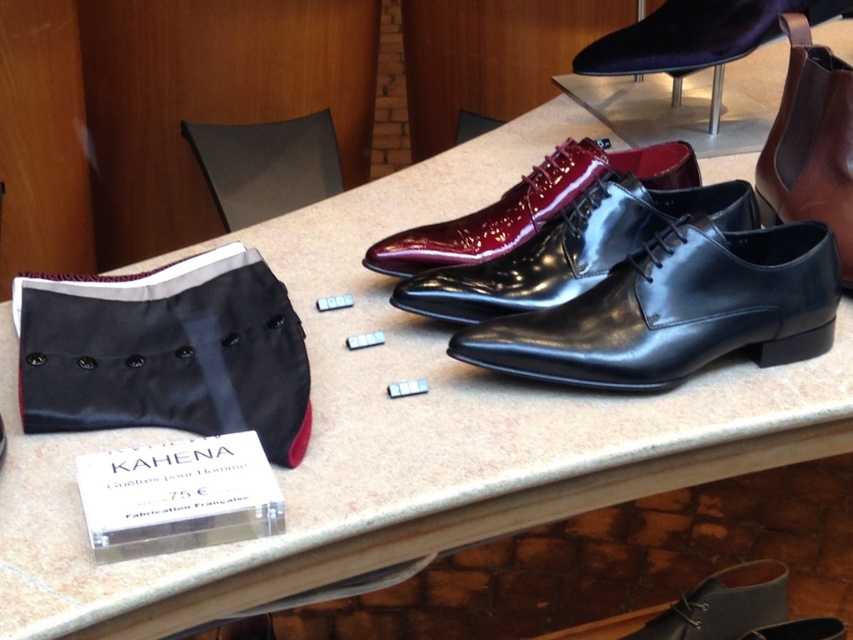
Who is shorter, black leather shoes at center or shiny black leather shoes at center?

Standing shorter between the two is shiny black leather shoes at center.

Between black leather shoes at center and shiny black leather shoes at center, which one has more height?

Standing taller between the two is black leather shoes at center.

The width and height of the screenshot is (853, 640). What do you see at coordinates (676, 310) in the screenshot?
I see `black leather shoes at center` at bounding box center [676, 310].

Identify the location of black leather shoes at center. (676, 310).

Does black leather shoes at center appear on the right side of glossy patent leather dress shoe at center?

Yes, black leather shoes at center is to the right of glossy patent leather dress shoe at center.

Who is more distant from viewer, (x=820, y=282) or (x=637, y=177)?

Positioned behind is point (x=637, y=177).

This screenshot has height=640, width=853. Find the location of `black leather shoes at center`. black leather shoes at center is located at coordinates (676, 310).

Can you confirm if brown leather boot at upper right is positioned above glossy patent leather dress shoe at center?

Correct, brown leather boot at upper right is located above glossy patent leather dress shoe at center.

Between brown leather boot at upper right and glossy patent leather dress shoe at center, which one is positioned higher?

brown leather boot at upper right is higher up.

Does point (833, 211) come in front of point (505, 227)?

Yes.

Where is `brown leather boot at upper right`? Image resolution: width=853 pixels, height=640 pixels. brown leather boot at upper right is located at coordinates (811, 141).